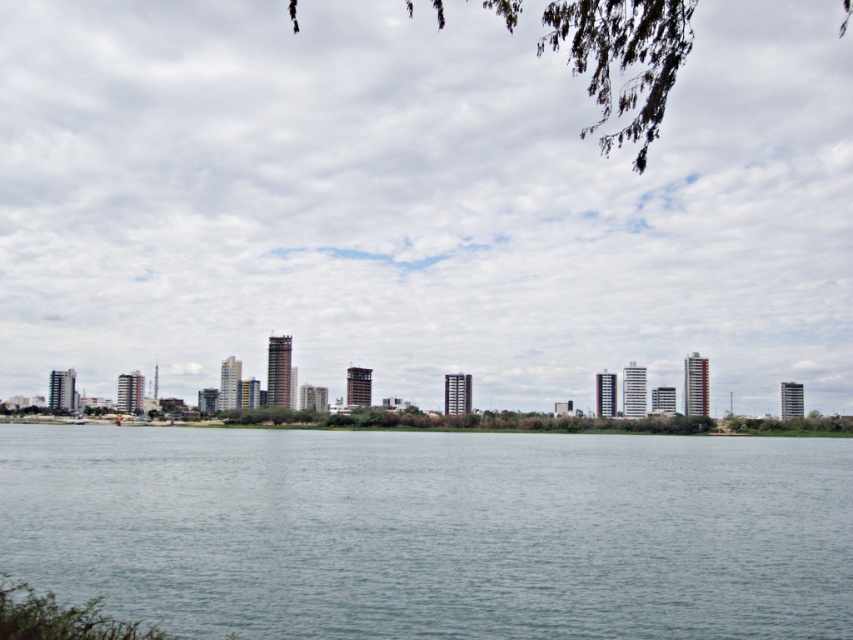
You are a photographer planning to capture the city skyline and the water in the image. You want to ensure that the transparent glass skyline at center and the gray water at center are both visible in your shot. Based on their positions, which object should you position first in your frame to include both?

The transparent glass skyline at center is to the right of gray water at center. To include both in the frame, position the gray water at center on the left side of the frame so that the transparent glass skyline at center can be placed to its right.

You are a photographer planning to take a photo of the transparent glass skyline at center and the gray water at center. Based on their sizes in the image, which one would you focus on to ensure it occupies more space in your photo?

The transparent glass skyline at center is bigger than the gray water at center, so focusing on it would ensure it occupies more space in the photo.

You are a city planner analyzing an urban landscape image. The image includes a point labeled as point (418, 202). Based on the scene description, what does this point most likely represent?

The point (418, 202) most likely represents the location of the transparent glass skyline at center as indicated in the objects description.